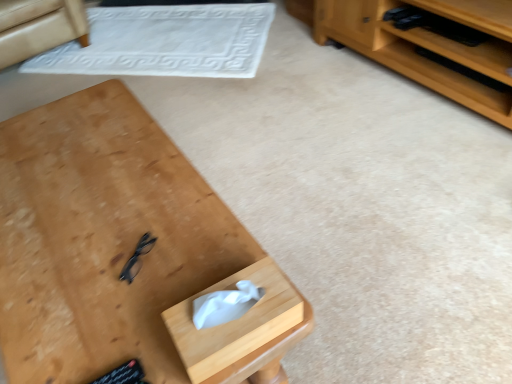
Question: Is wooden desk at center thinner than wooden tissue box at lower center?

Choices:
 (A) no
 (B) yes

Answer: (A)

Question: From a real-world perspective, is wooden desk at center on top of wooden tissue box at lower center?

Choices:
 (A) yes
 (B) no

Answer: (B)

Question: Can you confirm if wooden desk at center is taller than wooden tissue box at lower center?

Choices:
 (A) no
 (B) yes

Answer: (B)

Question: Can you confirm if wooden desk at center is bigger than wooden tissue box at lower center?

Choices:
 (A) no
 (B) yes

Answer: (B)

Question: From a real-world perspective, is wooden desk at center physically below wooden tissue box at lower center?

Choices:
 (A) no
 (B) yes

Answer: (B)

Question: Is white textured mat at upper center inside or outside of beige fabric armchair at upper left?

Choices:
 (A) inside
 (B) outside

Answer: (B)

Question: Is point (109, 71) positioned closer to the camera than point (15, 3)?

Choices:
 (A) closer
 (B) farther

Answer: (B)

Question: From the image's perspective, is white textured mat at upper center above or below beige fabric armchair at upper left?

Choices:
 (A) below
 (B) above

Answer: (A)

Question: From a real-world perspective, is white textured mat at upper center above or below beige fabric armchair at upper left?

Choices:
 (A) below
 (B) above

Answer: (A)

Question: Is point (117, 223) closer or farther from the camera than point (210, 331)?

Choices:
 (A) closer
 (B) farther

Answer: (B)

Question: In terms of height, does wooden desk at center look taller or shorter compared to wooden tissue box at lower center?

Choices:
 (A) tall
 (B) short

Answer: (A)

Question: From the image's perspective, is wooden desk at center above or below wooden tissue box at lower center?

Choices:
 (A) below
 (B) above

Answer: (B)

Question: Would you say wooden desk at center is inside or outside wooden tissue box at lower center?

Choices:
 (A) outside
 (B) inside

Answer: (A)

Question: Is point (64, 39) positioned closer to the camera than point (269, 345)?

Choices:
 (A) closer
 (B) farther

Answer: (B)

Question: In terms of width, does beige fabric armchair at upper left look wider or thinner when compared to wooden tissue box at lower center?

Choices:
 (A) thin
 (B) wide

Answer: (B)